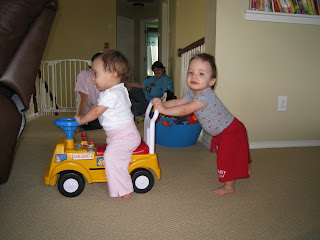
Where is `front wheel of toy`? This screenshot has height=240, width=320. front wheel of toy is located at coordinates [63, 176].